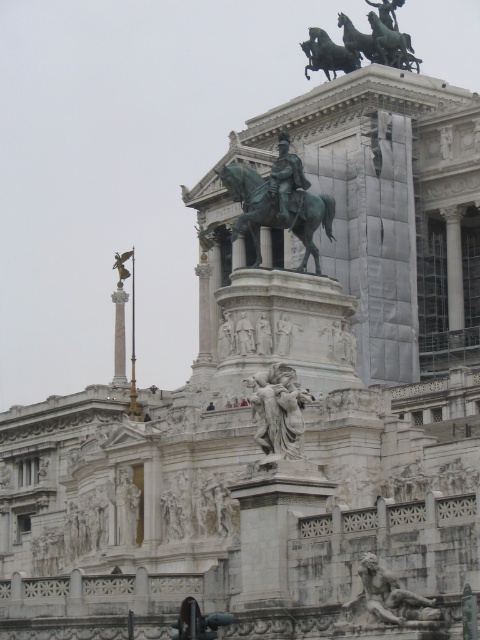
Between bronze/golden statue at center and green patina bronze chariot at upper center, which one is positioned higher?

green patina bronze chariot at upper center is higher up.

Is the position of bronze/golden statue at center less distant than that of green patina bronze chariot at upper center?

Yes, bronze/golden statue at center is closer to the viewer.

Who is more distant from viewer, (302, 234) or (388, 17)?

The point (388, 17) is behind.

Locate an element on the screen. The image size is (480, 640). bronze/golden statue at center is located at coordinates [x=276, y=211].

Who is taller, polished stone statue at center or bronze statue at center?

Standing taller between the two is bronze statue at center.

Looking at this image, can you confirm if polished stone statue at center is taller than bronze statue at center?

Incorrect, polished stone statue at center's height is not larger of bronze statue at center's.

At what (x,y) coordinates should I click in order to perform the action: click on polished stone statue at center. Please return your answer as a coordinate pair (x, y). Looking at the image, I should click on (278, 410).

Does green patina bronze chariot at upper center have a lesser width compared to polished stone statue at center?

In fact, green patina bronze chariot at upper center might be wider than polished stone statue at center.

Which is behind, point (352, 56) or point (271, 380)?

Point (352, 56)

Where is `green patina bronze chariot at upper center`? green patina bronze chariot at upper center is located at coordinates (361, 44).